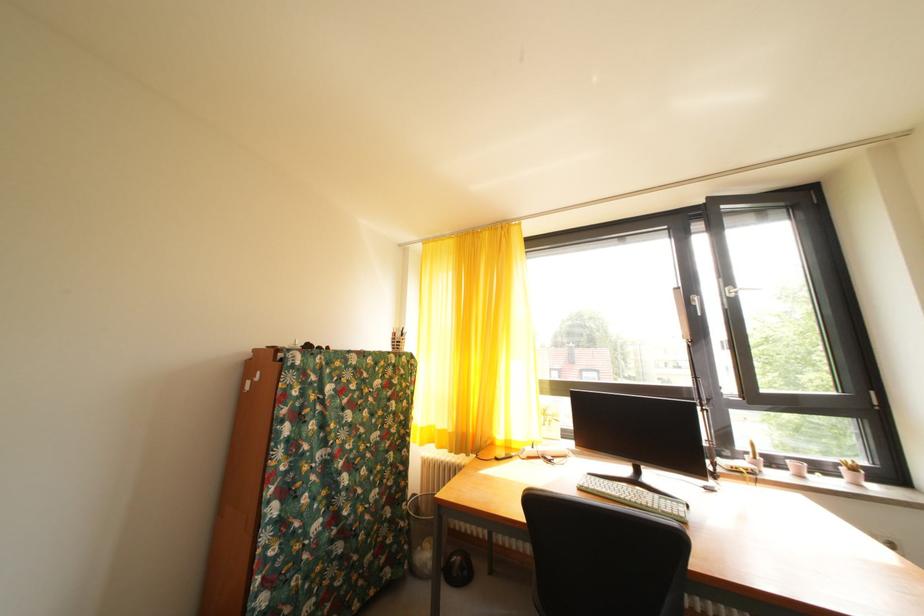
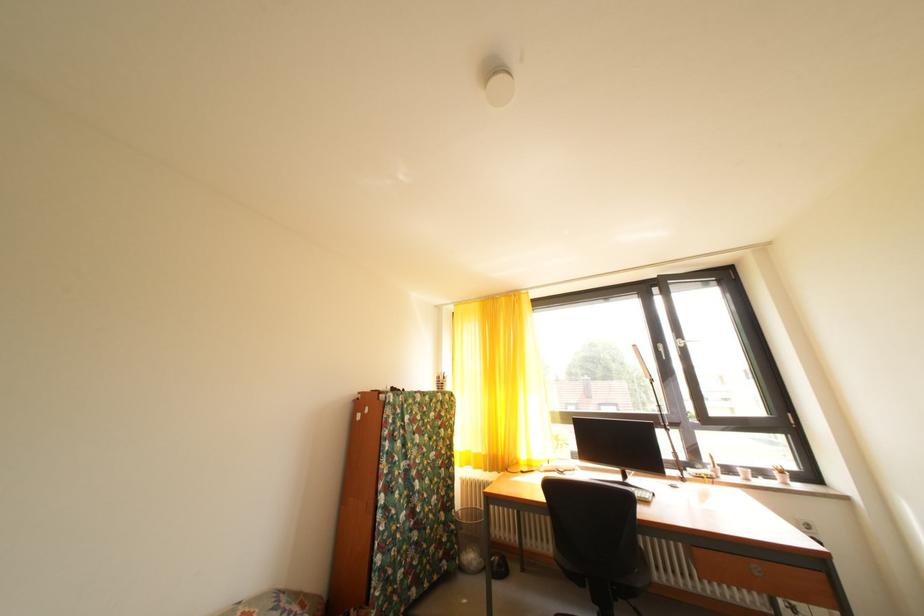
In the second image, find the point that corresponds to point 410,530 in the first image.

(462, 533)